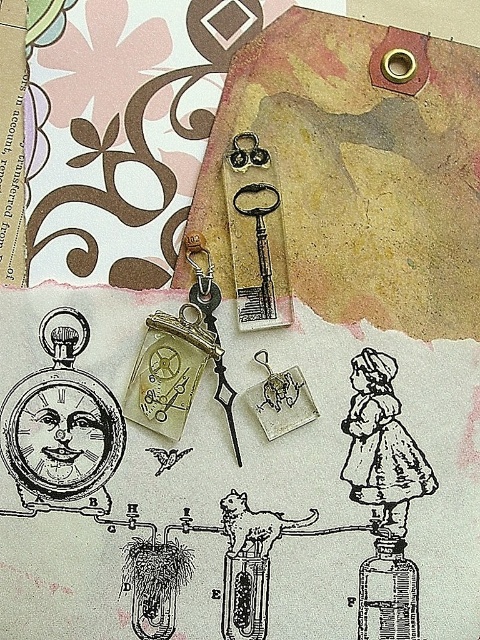
Can you confirm if silver metallic pocket watch at lower left is thinner than matte glass bottle at center?

No.

Which is more to the left, silver metallic pocket watch at lower left or matte glass bottle at center?

silver metallic pocket watch at lower left is more to the left.

Where is `silver metallic pocket watch at lower left`? The width and height of the screenshot is (480, 640). silver metallic pocket watch at lower left is located at coordinates (61, 426).